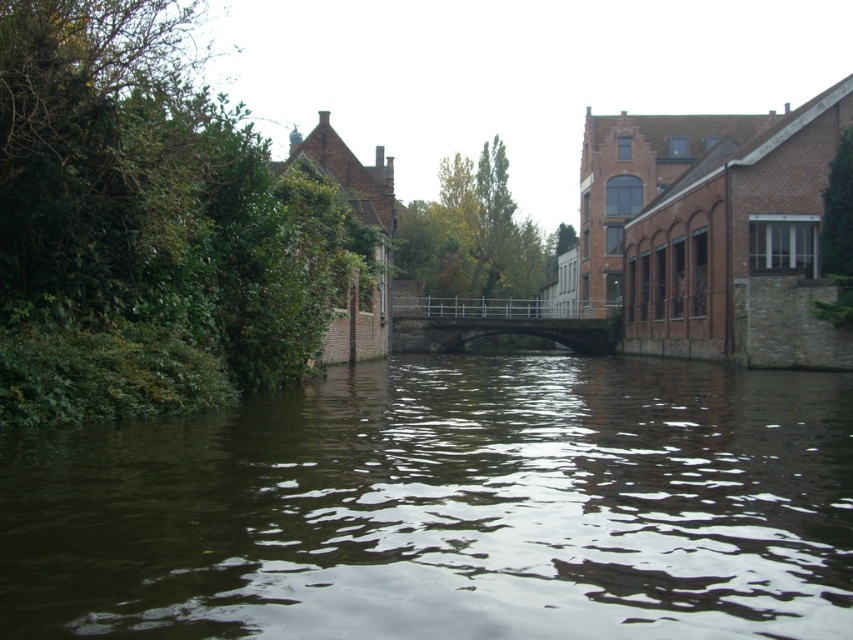
Is brown water at center below metallic gray bridge at center?

Yes, brown water at center is below metallic gray bridge at center.

Between point (189, 557) and point (526, 308), which one is positioned behind?

The point (526, 308) is more distant.

Locate an element on the screen. This screenshot has width=853, height=640. brown water at center is located at coordinates point(445,508).